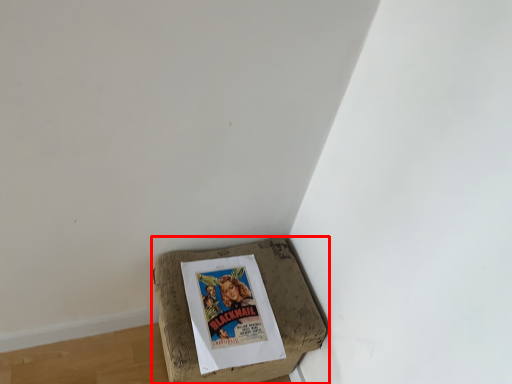
Question: From the image, what is the correct spatial relationship of furniture (annotated by the red box) in relation to comic book?

Choices:
 (A) right
 (B) left

Answer: (B)